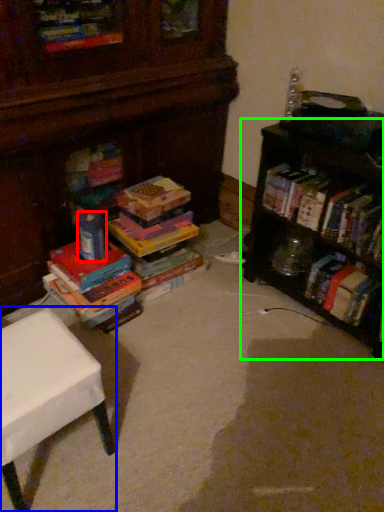
Question: Based on their relative distances, which object is nearer to toy (highlighted by a red box)? Choose from table (highlighted by a blue box) and shelf (highlighted by a green box).

Choices:
 (A) table
 (B) shelf

Answer: (A)